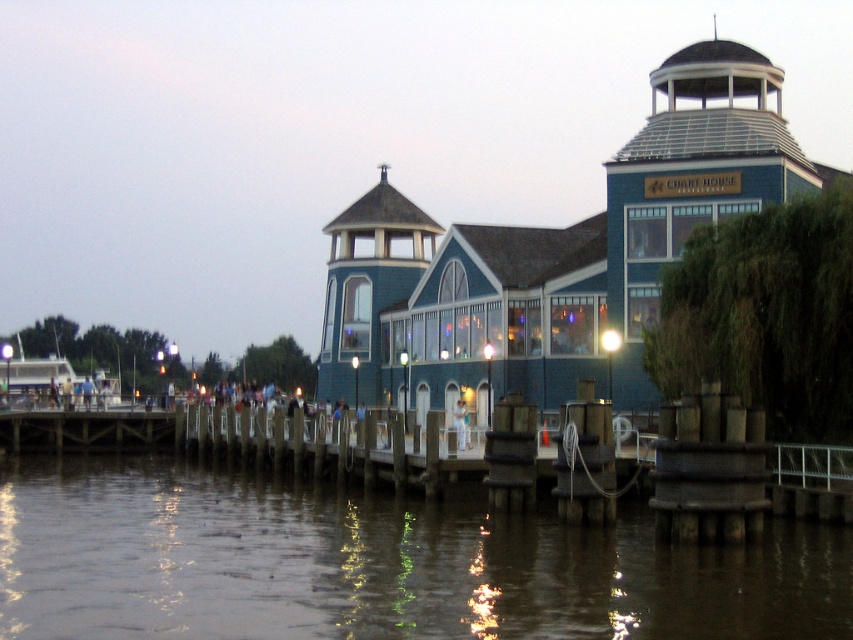
Question: From the image, what is the correct spatial relationship of blue wooden gazebo at center in relation to brown murky water at lower center?

Choices:
 (A) right
 (B) left

Answer: (A)

Question: Is brown murky water at lower center bigger than white glossy boat at lower left?

Choices:
 (A) no
 (B) yes

Answer: (A)

Question: Which of the following is the closest to the observer?

Choices:
 (A) white fabric dress at center
 (B) blue wooden gazebo at center
 (C) white glossy boat at lower left

Answer: (B)

Question: Can you confirm if brown murky water at lower center is bigger than white fabric dress at center?

Choices:
 (A) yes
 (B) no

Answer: (A)

Question: Which is nearer to the brown murky water at lower center?

Choices:
 (A) white glossy boat at lower left
 (B) white fabric dress at center

Answer: (B)

Question: Which point is closer to the camera?

Choices:
 (A) (436, 369)
 (B) (21, 365)
 (C) (334, 600)

Answer: (C)